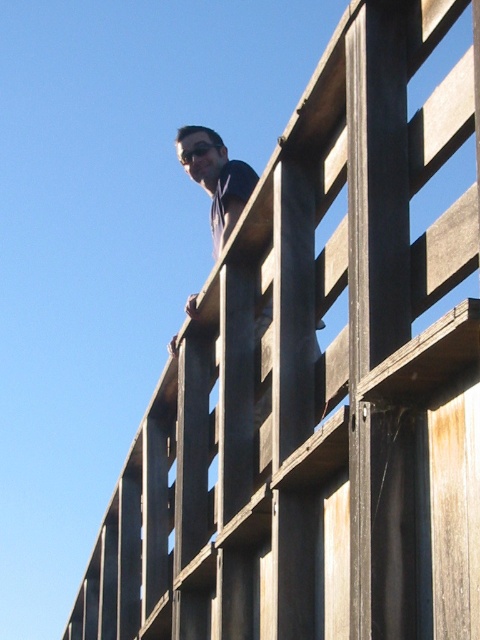
Question: Which point is closer to the camera?

Choices:
 (A) (180, 156)
 (B) (317, 355)

Answer: (B)

Question: Is matte black shirt at upper center above black matte goggles at upper center?

Choices:
 (A) no
 (B) yes

Answer: (A)

Question: Which point is closer to the camera?

Choices:
 (A) matte black shirt at upper center
 (B) black matte goggles at upper center

Answer: (A)

Question: Is matte black shirt at upper center below black matte goggles at upper center?

Choices:
 (A) yes
 (B) no

Answer: (A)

Question: Does matte black shirt at upper center have a greater width compared to black matte goggles at upper center?

Choices:
 (A) yes
 (B) no

Answer: (A)

Question: Which object is closer to the camera taking this photo?

Choices:
 (A) black matte goggles at upper center
 (B) matte black shirt at upper center

Answer: (B)